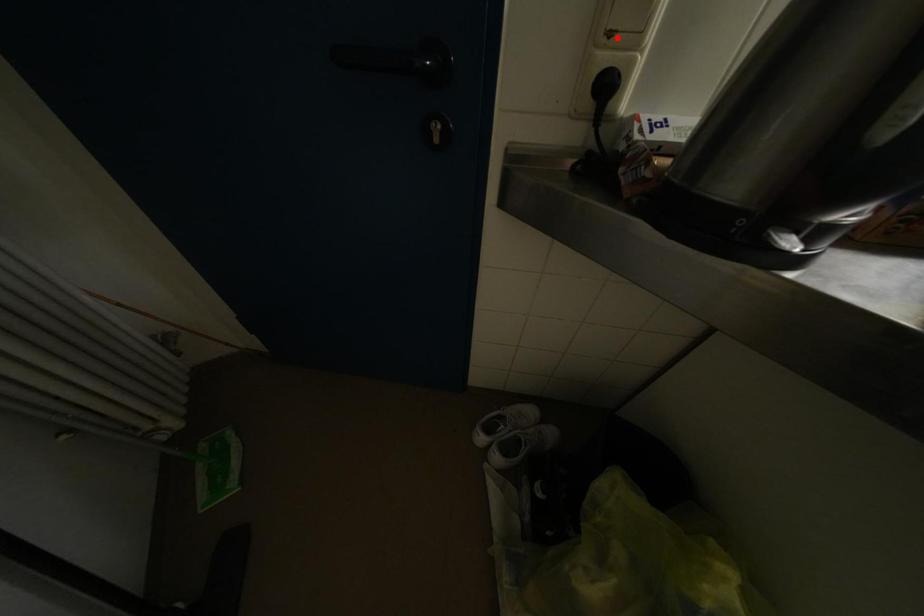
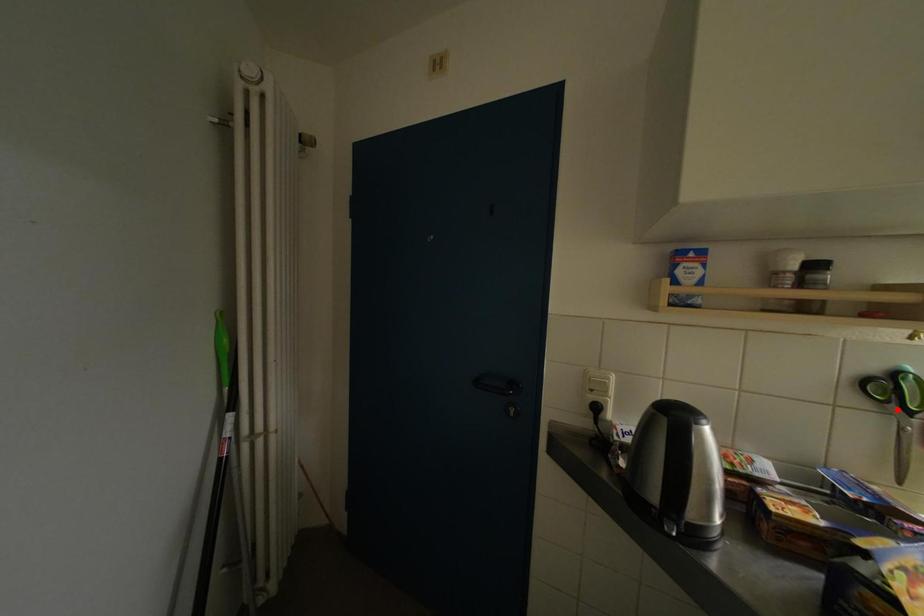
I am providing you with two images of the same scene from different viewpoints. A red point is marked on the first image and another point is marked on the second image. Does the point marked in image1 correspond to the same location as the one in image2?

No